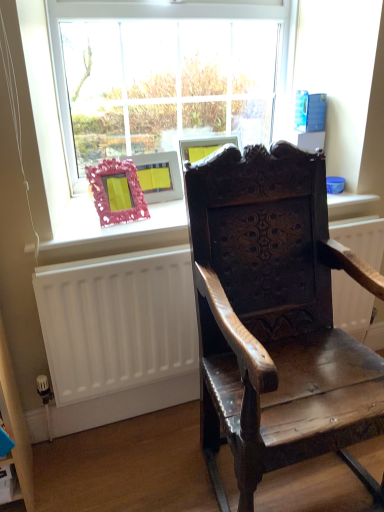
Question: Does dark wood carved chair at center have a larger size compared to wooden frame at upper center?

Choices:
 (A) no
 (B) yes

Answer: (B)

Question: Is dark wood carved chair at center in contact with wooden frame at upper center?

Choices:
 (A) yes
 (B) no

Answer: (B)

Question: From the image's perspective, is dark wood carved chair at center located above wooden frame at upper center?

Choices:
 (A) no
 (B) yes

Answer: (A)

Question: Is dark wood carved chair at center closer to the viewer compared to wooden frame at upper center?

Choices:
 (A) no
 (B) yes

Answer: (B)

Question: From a real-world perspective, does dark wood carved chair at center stand above wooden frame at upper center?

Choices:
 (A) yes
 (B) no

Answer: (B)

Question: Can you confirm if dark wood carved chair at center is thinner than wooden frame at upper center?

Choices:
 (A) yes
 (B) no

Answer: (B)

Question: Can you confirm if white matte radiator at lower left is thinner than dark wood carved chair at center?

Choices:
 (A) no
 (B) yes

Answer: (B)

Question: Is white matte radiator at lower left facing away from dark wood carved chair at center?

Choices:
 (A) no
 (B) yes

Answer: (B)

Question: From the image's perspective, does white matte radiator at lower left appear higher than dark wood carved chair at center?

Choices:
 (A) no
 (B) yes

Answer: (A)

Question: Is white matte radiator at lower left placed right next to dark wood carved chair at center?

Choices:
 (A) yes
 (B) no

Answer: (B)

Question: Is white matte radiator at lower left positioned in front of dark wood carved chair at center?

Choices:
 (A) no
 (B) yes

Answer: (A)

Question: Considering the relative sizes of white matte radiator at lower left and dark wood carved chair at center in the image provided, is white matte radiator at lower left bigger than dark wood carved chair at center?

Choices:
 (A) no
 (B) yes

Answer: (A)

Question: Is clear glass window at upper center outside of white matte radiator at lower left?

Choices:
 (A) yes
 (B) no

Answer: (A)